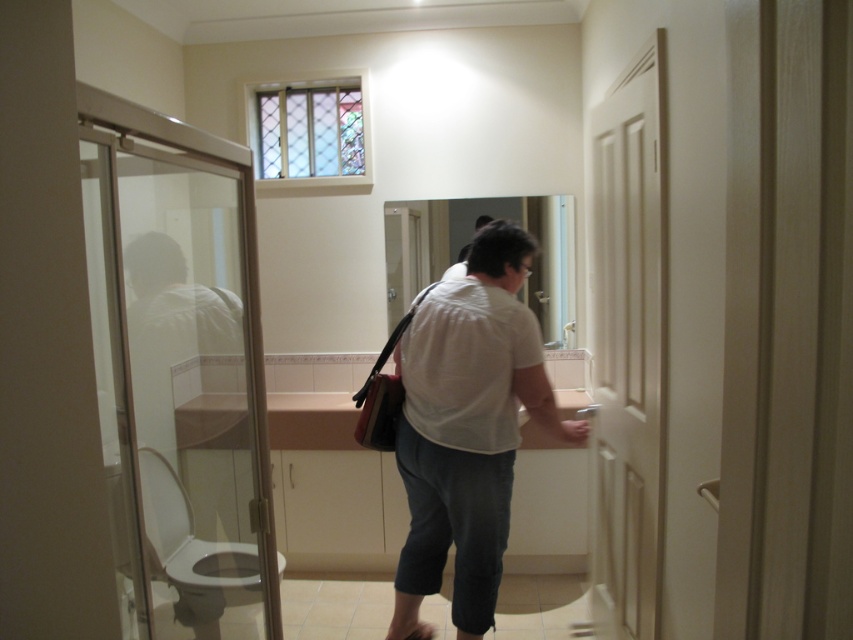
You are a tailor who needs to determine if the white matte shirt at center can fit through the opening of the white matte door at right without any adjustments. Based on the scene, can the shirt pass through the door?

The white matte shirt at center is larger in size than the white matte door at right, so it cannot pass through the door without adjustments.

You are standing in the bathroom and need to exit. There is a white matte door at right and a white glossy toilet bowl at lower left. Which object should you approach to leave the bathroom?

To exit the bathroom, you should approach the white matte door at right since doors are typically used for exiting, whereas the white glossy toilet bowl at lower left is a fixture and not an exit point.